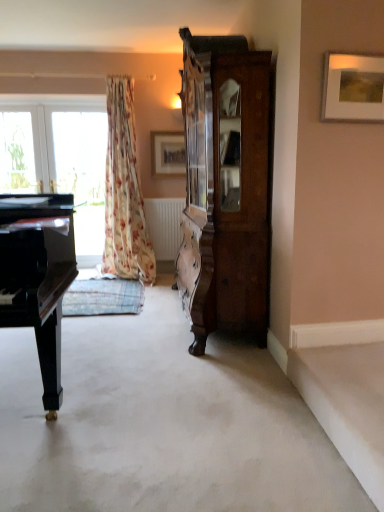
Image resolution: width=384 pixels, height=512 pixels. Describe the element at coordinates (161, 423) in the screenshot. I see `white carpet at center` at that location.

This screenshot has height=512, width=384. What do you see at coordinates (38, 276) in the screenshot?
I see `high-gloss black piano at left` at bounding box center [38, 276].

This screenshot has height=512, width=384. I want to click on dark wood cabinet at right, so click(233, 186).

You are a GUI agent. You are given a task and a screenshot of the screen. Output one action in this format:
    pyautogui.click(x=<x>, y=<y>)
    Task: Click on the white matte radiator at center
    The width and height of the screenshot is (384, 512).
    Given the screenshot: What is the action you would take?
    pyautogui.click(x=164, y=225)

Describe the element at coordinates (164, 225) in the screenshot. I see `white matte radiator at center` at that location.

Measure the distance between point (30, 160) and camera.

Point (30, 160) and camera are 16.88 feet apart.

Measure the distance between transparent glass window at left and camera.

A distance of 4.83 meters exists between transparent glass window at left and camera.

Where is `wooden picture frame at upper right, positioned as the first picture frame in front-to-back order`? The width and height of the screenshot is (384, 512). wooden picture frame at upper right, positioned as the first picture frame in front-to-back order is located at coordinates (353, 88).

What are the coordinates of `transparent glass window at left` in the screenshot? It's located at (82, 173).

Is white matte radiator at center not inside transparent glass window at left?

That's correct, white matte radiator at center is outside of transparent glass window at left.

Based on their positions, is white matte radiator at center located to the left or right of transparent glass window at left?

From the image, it's evident that white matte radiator at center is to the right of transparent glass window at left.

Is white matte radiator at center taller than transparent glass window at left?

In fact, white matte radiator at center may be shorter than transparent glass window at left.

Based on the photo, is high-gloss black piano at left thinner than transparent glass window at left?

No.

Can you confirm if high-gloss black piano at left is smaller than transparent glass window at left?

No.

Considering the sizes of high-gloss black piano at left and transparent glass window at left in the image, is high-gloss black piano at left taller or shorter than transparent glass window at left?

Considering their sizes, high-gloss black piano at left has less height than transparent glass window at left.

Can you tell me how much high-gloss black piano at left and transparent glass window at left differ in facing direction?

There is a 1.33-degree angle between the facing directions of high-gloss black piano at left and transparent glass window at left.

What's the angular difference between high-gloss black piano at left and dark wood cabinet at right's facing directions?

The angular difference between high-gloss black piano at left and dark wood cabinet at right is 87.6 degrees.

Who is taller, high-gloss black piano at left or dark wood cabinet at right?

With more height is dark wood cabinet at right.

Which object is positioned more to the left, high-gloss black piano at left or dark wood cabinet at right?

high-gloss black piano at left.

Is point (58, 402) closer or farther from the camera than point (242, 253)?

Point (58, 402) appears to be closer to the viewer than point (242, 253).

From the image's perspective, is transparent glass window at left positioned above or below white carpet at center?

From the image's perspective, transparent glass window at left appears above white carpet at center.

Is transparent glass window at left not near white carpet at center?

Yes, transparent glass window at left is far from white carpet at center.

In the scene shown: Which is behind, transparent glass window at left or white carpet at center?

transparent glass window at left is behind.

From a real-world perspective, which is physically below, transparent glass window at left or white carpet at center?

In real-world perspective, white carpet at center is lower.

Between white carpet at center and white matte radiator at center, which one has more height?

white matte radiator at center.

Is white carpet at center positioned far away from white matte radiator at center?

Indeed, white carpet at center is not near white matte radiator at center.

Can you confirm if white carpet at center is positioned to the right of white matte radiator at center?

→ Incorrect, white carpet at center is not on the right side of white matte radiator at center.

Considering the sizes of objects white carpet at center and white matte radiator at center in the image provided, who is thinner, white carpet at center or white matte radiator at center?

With smaller width is white matte radiator at center.

In the scene shown: Can you confirm if floral fabric curtain at left is taller than transparent glass window at left?

Correct, floral fabric curtain at left is much taller as transparent glass window at left.

How many degrees apart are the facing directions of floral fabric curtain at left and transparent glass window at left?

There is a 0.729-degree angle between the facing directions of floral fabric curtain at left and transparent glass window at left.

From the image's perspective, is floral fabric curtain at left on transparent glass window at left?

Actually, floral fabric curtain at left appears below transparent glass window at left in the image.

Does point (128, 236) come closer to viewer compared to point (35, 172)?

Yes.

Is floral fabric curtain at left positioned with its back to transparent glass window at left?

No.

Consider the image. Is floral fabric curtain at left taller than transparent glass window at left?

Yes.

From a real-world perspective, is floral fabric curtain at left physically located above or below transparent glass window at left?

floral fabric curtain at left is above transparent glass window at left.

In the scene shown: Considering the positions of objects floral fabric curtain at left and transparent glass window at left in the image provided, who is more to the right, floral fabric curtain at left or transparent glass window at left?

Positioned to the right is floral fabric curtain at left.

The height and width of the screenshot is (512, 384). In order to click on radiator on the right side of transparent glass window at left in this screenshot , I will do `click(164, 225)`.

At what (x,y) coordinates should I click in order to perform the action: click on piano in front of the transparent glass window at left. Please return your answer as a coordinate pair (x, y). Looking at the image, I should click on (38, 276).

Considering their positions, is white carpet at center positioned closer to wooden picture frame at upper right, the 1th picture frame when ordered from right to left, than wooden picture frame at center, the second picture frame when ordered from front to back?

white carpet at center lies closer to wooden picture frame at upper right, the 1th picture frame when ordered from right to left, than the other object.

Based on their spatial positions, is transparent glass window at left or white carpet at center further from floral fabric curtain at left?

white carpet at center.

Which object lies further to the anchor point high-gloss black piano at left, transparent glass window at left or white matte radiator at center?

Based on the image, transparent glass window at left appears to be further to high-gloss black piano at left.

From the picture: When comparing their distances from high-gloss black piano at left, does dark wood cabinet at right or wooden picture frame at upper right, positioned as the first picture frame in front-to-back order, seem further?

wooden picture frame at upper right, positioned as the first picture frame in front-to-back order, is further to high-gloss black piano at left.

Which object lies further to the anchor point dark wood cabinet at right, transparent glass window at left or high-gloss black piano at left?

transparent glass window at left is positioned further to the anchor dark wood cabinet at right.

From the image, which object appears to be nearer to transparent glass window at left, white matte radiator at center or floral fabric curtain at left?

floral fabric curtain at left is closer to transparent glass window at left.

Which object lies nearer to the anchor point wooden picture frame at upper right, arranged as the 2th picture frame when viewed from the left, white matte radiator at center or white carpet at center?

Based on the image, white carpet at center appears to be nearer to wooden picture frame at upper right, arranged as the 2th picture frame when viewed from the left.

Estimate the real-world distances between objects in this image. Which object is further from white matte radiator at center, wooden picture frame at center, the 2th picture frame positioned from the right, or white carpet at center?

The object further to white matte radiator at center is white carpet at center.

Find the location of a particular element. Image resolution: width=384 pixels, height=512 pixels. radiator between transparent glass window at left and wooden picture frame at center, the 2th picture frame positioned from the right, in the horizontal direction is located at coordinates (164, 225).

At what (x,y) coordinates should I click in order to perform the action: click on window positioned between dark wood cabinet at right and white matte radiator at center from near to far. Please return your answer as a coordinate pair (x, y). The width and height of the screenshot is (384, 512). Looking at the image, I should click on (19, 153).

Locate an element on the screen. The height and width of the screenshot is (512, 384). curtain situated between transparent glass window at left and wooden picture frame at center, the second picture frame when ordered from front to back, from left to right is located at coordinates (124, 191).

The image size is (384, 512). I want to click on cabinetry situated between high-gloss black piano at left and wooden picture frame at upper right, which appears as the 2th picture frame when viewed from the back, from left to right, so click(233, 186).